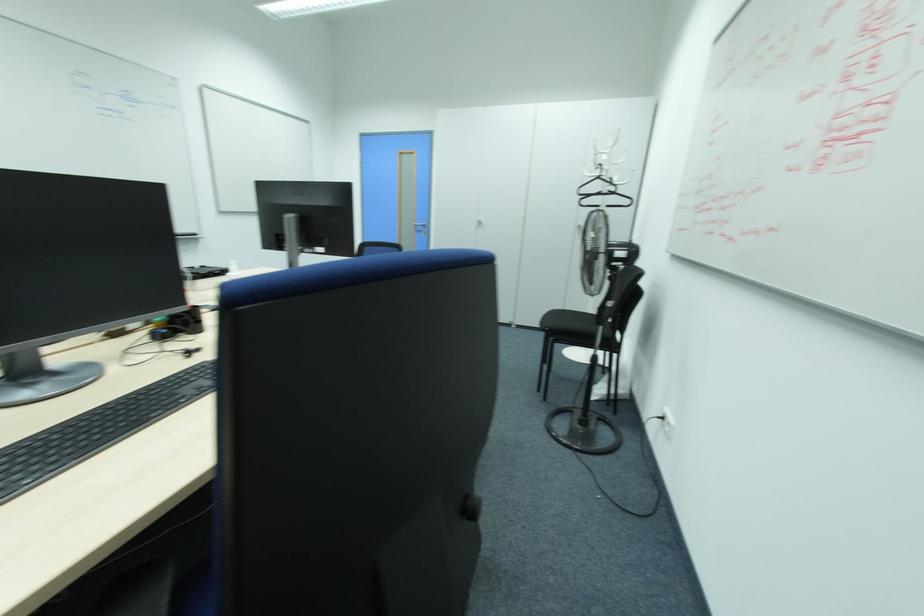
At what (x,y) coordinates should I click in order to perform the action: click on black clothes hanger. Please return your answer as a coordinate pair (x, y). Looking at the image, I should click on (602, 193).